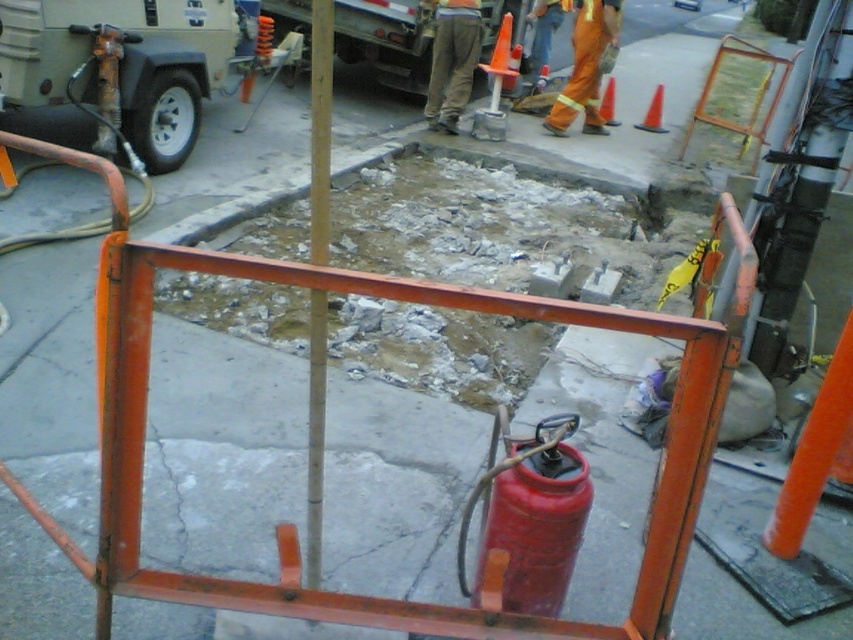
Question: Which of the following is the farthest from the observer?

Choices:
 (A) orange reflective pants at center
 (B) matte red extinguisher at center

Answer: (A)

Question: Where is matte red extinguisher at center located in relation to brown cotton pants at center in the image?

Choices:
 (A) above
 (B) below

Answer: (B)

Question: Which point is farther to the camera?

Choices:
 (A) orange plastic traffic cone at center
 (B) white smooth pole at center

Answer: (A)

Question: Considering the relative positions of orange reflective pants at center and orange plastic traffic cone at center in the image provided, where is orange reflective pants at center located with respect to orange plastic traffic cone at center?

Choices:
 (A) left
 (B) right

Answer: (B)

Question: Is brown cotton pants at center behind orange plastic traffic cone at upper right?

Choices:
 (A) yes
 (B) no

Answer: (B)

Question: Estimate the real-world distances between objects in this image. Which object is farther from the orange plastic traffic cone at upper center?

Choices:
 (A) orange plastic traffic cone at upper right
 (B) orange plastic traffic cone at center

Answer: (B)